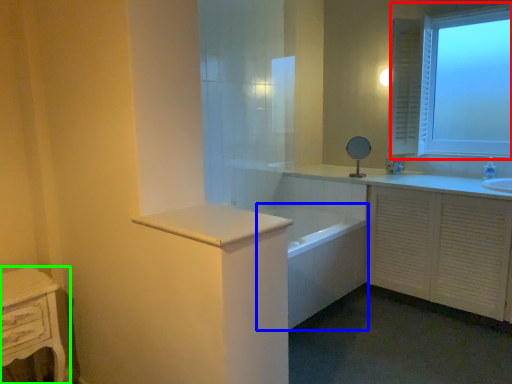
Question: Which object is positioned closest to window (highlighted by a red box)? Select from bath (highlighted by a blue box) and nightstand (highlighted by a green box).

Choices:
 (A) bath
 (B) nightstand

Answer: (A)